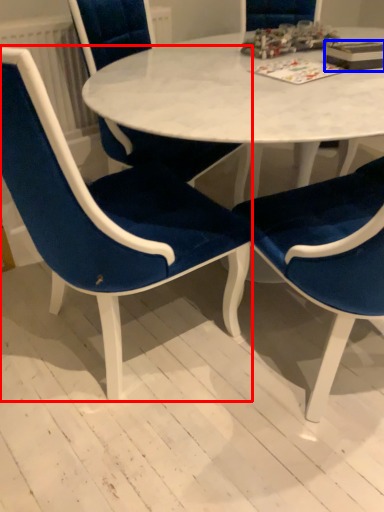
Question: Which object appears farthest to the camera in this image, chair (highlighted by a red box) or book (highlighted by a blue box)?

Choices:
 (A) chair
 (B) book

Answer: (B)